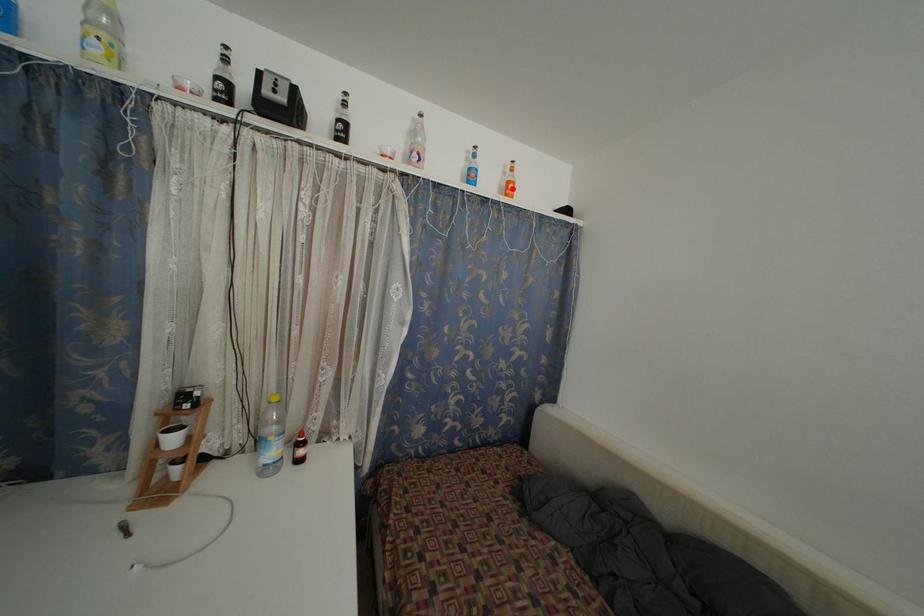
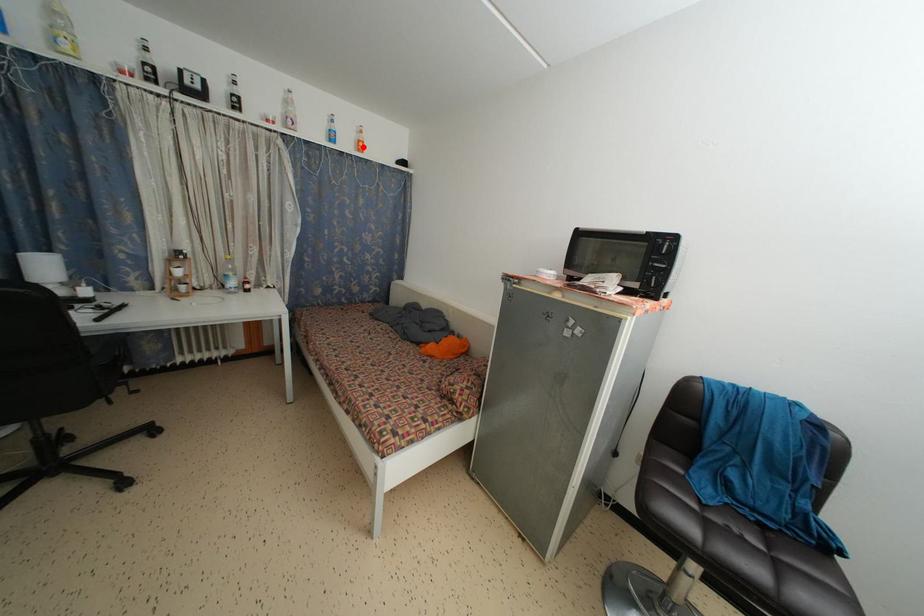
I am providing you with two images of the same scene from different viewpoints. A red point is marked on the first image and another point is marked on the second image. Are the points marked in image1 and image2 representing the same 3D position?

Yes